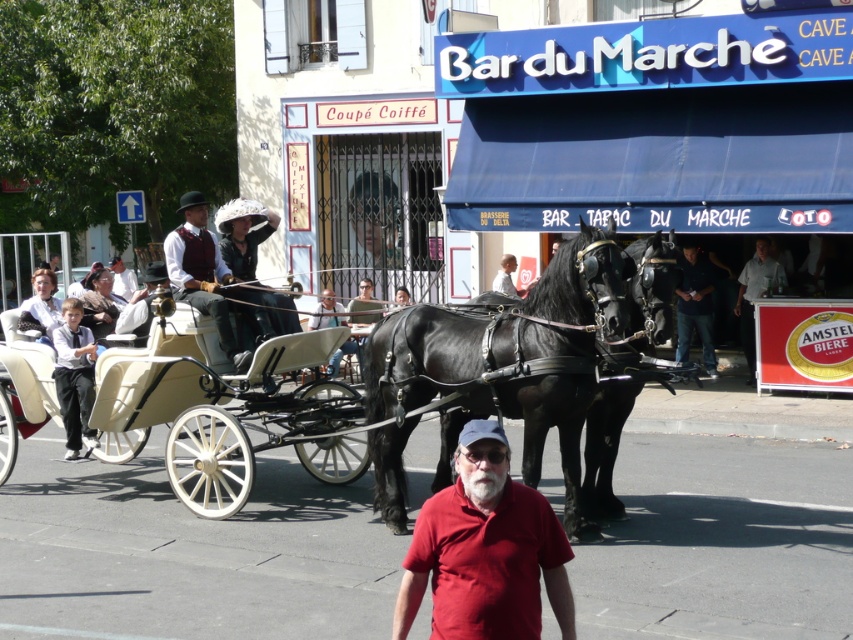
Question: Does matte brown vest at center appear under dark blue jeans at center?

Choices:
 (A) yes
 (B) no

Answer: (B)

Question: Which point appears closest to the camera in this image?

Choices:
 (A) (746, 337)
 (B) (682, 296)

Answer: (A)

Question: Which point is farther from the camera taking this photo?

Choices:
 (A) (703, 348)
 (B) (763, 275)

Answer: (A)

Question: Can you confirm if white leather horse cart at center is wider than matte brown vest at center?

Choices:
 (A) yes
 (B) no

Answer: (A)

Question: Does red matte shirt at center have a lesser width compared to gray fabric shirt at center?

Choices:
 (A) no
 (B) yes

Answer: (A)

Question: Which point is farther from the camera taking this photo?

Choices:
 (A) (70, 428)
 (B) (743, 332)
 (C) (703, 330)
 (D) (340, 320)

Answer: (D)